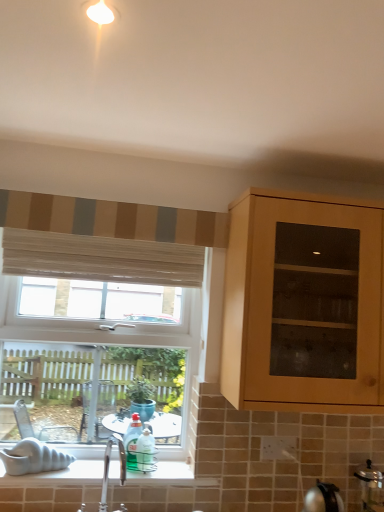
Measure the distance between point (375, 476) and camera.

The distance of point (375, 476) from camera is 5.75 feet.

Measure the distance between polished chrome tap at lower center and camera.

5.26 feet.

What do you see at coordinates (97, 362) in the screenshot? I see `clear glass window at lower left` at bounding box center [97, 362].

Find the location of a particular element. striped fabric at upper left, arranged as the 2th curtain when ordered from the bottom is located at coordinates (112, 219).

I want to click on satin silver pressure cooker at lower right, so click(371, 487).

Does satin silver pressure cooker at lower right have a greater width compared to striped fabric at upper left, which is the first curtain from top to bottom?

Indeed, satin silver pressure cooker at lower right has a greater width compared to striped fabric at upper left, which is the first curtain from top to bottom.

Is satin silver pressure cooker at lower right in front of striped fabric at upper left, which is the first curtain from top to bottom?

No, satin silver pressure cooker at lower right is further to the viewer.

Identify the location of appliance on the right of striped fabric at upper left, which is the first curtain from top to bottom. (371, 487).

Is point (374, 472) positioned after point (72, 223)?

Yes, point (374, 472) is farther from viewer.

Which object is further away from the camera, striped fabric at upper left, arranged as the 2th curtain when ordered from the bottom, or wooden blinds at upper left, the second curtain viewed from the top?

wooden blinds at upper left, the second curtain viewed from the top.

Does striped fabric at upper left, arranged as the 2th curtain when ordered from the bottom, touch wooden blinds at upper left, acting as the 1th curtain starting from the bottom?

They are not placed beside each other.

Considering the positions of point (185, 210) and point (160, 251), is point (185, 210) closer or farther from the camera than point (160, 251)?

Point (185, 210).

Is striped fabric at upper left, which is the first curtain from top to bottom, oriented towards wooden blinds at upper left, acting as the 1th curtain starting from the bottom?

No, striped fabric at upper left, which is the first curtain from top to bottom, is not facing towards wooden blinds at upper left, acting as the 1th curtain starting from the bottom.

Who is more distant, wooden blinds at upper left, the second curtain viewed from the top, or satin silver pressure cooker at lower right?

wooden blinds at upper left, the second curtain viewed from the top.

Where is `appliance below the wooden blinds at upper left, acting as the 1th curtain starting from the bottom (from the image's perspective)`? Image resolution: width=384 pixels, height=512 pixels. appliance below the wooden blinds at upper left, acting as the 1th curtain starting from the bottom (from the image's perspective) is located at coordinates (371, 487).

How far apart are wooden blinds at upper left, the second curtain viewed from the top, and satin silver pressure cooker at lower right?

wooden blinds at upper left, the second curtain viewed from the top, and satin silver pressure cooker at lower right are 1.33 meters apart from each other.

Considering the positions of objects wooden blinds at upper left, acting as the 1th curtain starting from the bottom, and satin silver pressure cooker at lower right in the image provided, who is more to the left, wooden blinds at upper left, acting as the 1th curtain starting from the bottom, or satin silver pressure cooker at lower right?

wooden blinds at upper left, acting as the 1th curtain starting from the bottom.

Considering the relative positions of polished chrome tap at lower center and clear glass window at lower left in the image provided, is polished chrome tap at lower center to the right of clear glass window at lower left from the viewer's perspective?

Indeed, polished chrome tap at lower center is positioned on the right side of clear glass window at lower left.

Does point (108, 451) appear closer or farther from the camera than point (4, 370)?

Point (108, 451) appears to be closer to the viewer than point (4, 370).

Between polished chrome tap at lower center and clear glass window at lower left, which one has smaller size?

polished chrome tap at lower center is smaller.

Is polished chrome tap at lower center directly adjacent to clear glass window at lower left?

No, polished chrome tap at lower center is not in contact with clear glass window at lower left.

Are satin silver pressure cooker at lower right and clear glass window at lower left making contact?

satin silver pressure cooker at lower right and clear glass window at lower left are clearly separated.

Is clear glass window at lower left surrounded by satin silver pressure cooker at lower right?

No, clear glass window at lower left is located outside of satin silver pressure cooker at lower right.

From a real-world perspective, which is physically below, clear glass window at lower left or satin silver pressure cooker at lower right?

satin silver pressure cooker at lower right, from a real-world perspective.

Is there a large distance between clear glass window at lower left and satin silver pressure cooker at lower right?

Yes, clear glass window at lower left and satin silver pressure cooker at lower right are located far from each other.

Based on the photo, is clear glass window at lower left smaller than satin silver pressure cooker at lower right?

No, clear glass window at lower left is not smaller than satin silver pressure cooker at lower right.

Considering the positions of objects clear glass window at lower left and satin silver pressure cooker at lower right in the image provided, who is behind, clear glass window at lower left or satin silver pressure cooker at lower right?

Positioned behind is clear glass window at lower left.

The height and width of the screenshot is (512, 384). In order to click on window below the striped fabric at upper left, arranged as the 2th curtain when ordered from the bottom (from the image's perspective) in this screenshot , I will do `click(97, 362)`.

Based on the photo, how far apart are clear glass window at lower left and striped fabric at upper left, which is the first curtain from top to bottom?

A distance of 19.90 inches exists between clear glass window at lower left and striped fabric at upper left, which is the first curtain from top to bottom.

Is point (3, 242) less distant than point (107, 206)?

No, (3, 242) is behind (107, 206).

Is the surface of clear glass window at lower left in direct contact with striped fabric at upper left, which is the first curtain from top to bottom?

No, clear glass window at lower left is not in contact with striped fabric at upper left, which is the first curtain from top to bottom.

Where is `the 2nd curtain above the satin silver pressure cooker at lower right (from a real-world perspective)`? This screenshot has height=512, width=384. the 2nd curtain above the satin silver pressure cooker at lower right (from a real-world perspective) is located at coordinates (112, 219).

What are the coordinates of `curtain that appears on the left of striped fabric at upper left, which is the first curtain from top to bottom` in the screenshot? It's located at (101, 258).

Based on their spatial positions, is clear glass window at lower left or polished chrome tap at lower center closer to striped fabric at upper left, arranged as the 2th curtain when ordered from the bottom?

clear glass window at lower left lies closer to striped fabric at upper left, arranged as the 2th curtain when ordered from the bottom, than the other object.

Estimate the real-world distances between objects in this image. Which object is further from clear glass window at lower left, wooden blinds at upper left, the second curtain viewed from the top, or satin silver pressure cooker at lower right?

Based on the image, satin silver pressure cooker at lower right appears to be further to clear glass window at lower left.

Based on the photo, estimate the real-world distances between objects in this image. Which object is further from clear glass window at lower left, polished chrome tap at lower center or wooden blinds at upper left, the second curtain viewed from the top?

Based on the image, polished chrome tap at lower center appears to be further to clear glass window at lower left.

Based on their spatial positions, is translucent plastic bottle at window or wooden blinds at upper left, the second curtain viewed from the top, closer to satin silver pressure cooker at lower right?

translucent plastic bottle at window is positioned closer to the anchor satin silver pressure cooker at lower right.

From the image, which object appears to be farther from wooden blinds at upper left, the second curtain viewed from the top, clear glass window at lower left or satin silver pressure cooker at lower right?

Among the two, satin silver pressure cooker at lower right is located further to wooden blinds at upper left, the second curtain viewed from the top.

Looking at the image, which one is located closer to polished chrome tap at lower center, striped fabric at upper left, which is the first curtain from top to bottom, or wooden blinds at upper left, the second curtain viewed from the top?

wooden blinds at upper left, the second curtain viewed from the top, lies closer to polished chrome tap at lower center than the other object.

Looking at this image, looking at the image, which one is located closer to translucent plastic bottle at window, satin silver pressure cooker at lower right or wooden blinds at upper left, the second curtain viewed from the top?

Based on the image, wooden blinds at upper left, the second curtain viewed from the top, appears to be nearer to translucent plastic bottle at window.

From the image, which object appears to be farther from wooden blinds at upper left, acting as the 1th curtain starting from the bottom, translucent plastic bottle at window or striped fabric at upper left, arranged as the 2th curtain when ordered from the bottom?

translucent plastic bottle at window.

Identify the location of bottle that lies between wooden blinds at upper left, the second curtain viewed from the top, and polished chrome tap at lower center from top to bottom. (132, 441).

Where is `curtain that lies between striped fabric at upper left, arranged as the 2th curtain when ordered from the bottom, and polished chrome tap at lower center from top to bottom`? The image size is (384, 512). curtain that lies between striped fabric at upper left, arranged as the 2th curtain when ordered from the bottom, and polished chrome tap at lower center from top to bottom is located at coordinates (101, 258).

Where is `bottle between striped fabric at upper left, which is the first curtain from top to bottom, and polished chrome tap at lower center, in the vertical direction`? Image resolution: width=384 pixels, height=512 pixels. bottle between striped fabric at upper left, which is the first curtain from top to bottom, and polished chrome tap at lower center, in the vertical direction is located at coordinates (132, 441).

You are a GUI agent. You are given a task and a screenshot of the screen. Output one action in this format:
    pyautogui.click(x=<x>, y=<y>)
    Task: Click on the bottle between clear glass window at lower left and polished chrome tap at lower center in the up-down direction
    The image size is (384, 512).
    Given the screenshot: What is the action you would take?
    132,441